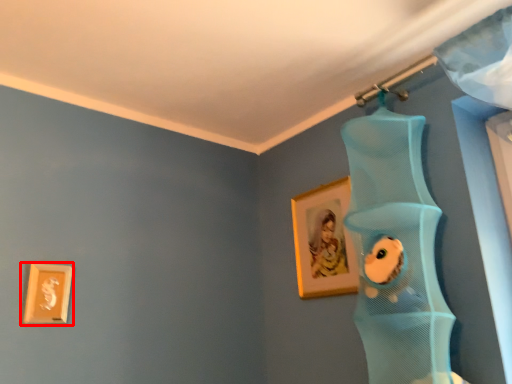
Question: From the image, what is the correct spatial relationship of picture frame (annotated by the red box) in relation to picture frame?

Choices:
 (A) left
 (B) right

Answer: (A)